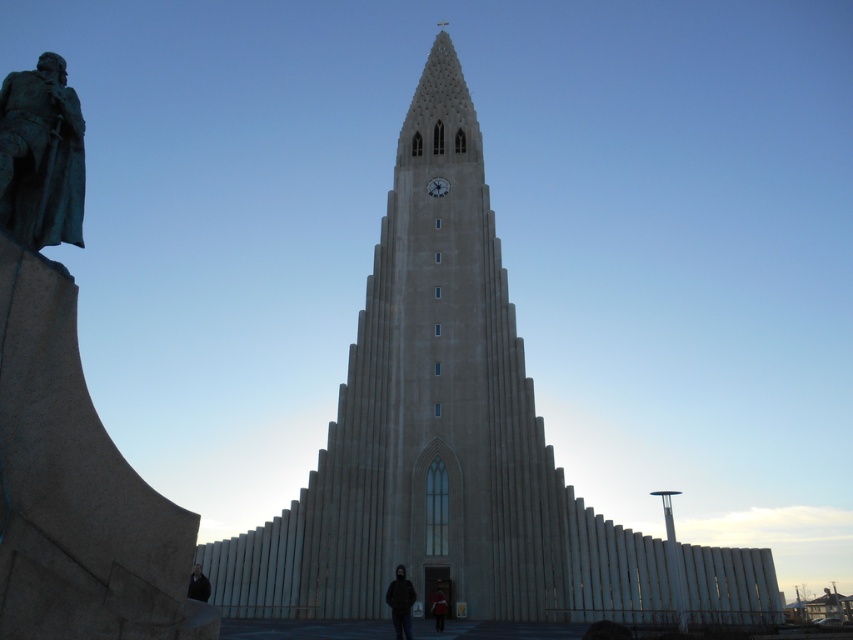
Is beige stone tower at center smaller than black matte jacket at lower center?

No.

Does point (502, 490) lie in front of point (393, 605)?

No, it is behind (393, 605).

You are a GUI agent. You are given a task and a screenshot of the screen. Output one action in this format:
    pyautogui.click(x=<x>, y=<y>)
    Task: Click on the beige stone tower at center
    This screenshot has width=853, height=640.
    Given the screenshot: What is the action you would take?
    pyautogui.click(x=457, y=442)

This screenshot has height=640, width=853. In order to click on beige stone tower at center in this screenshot , I will do `click(457, 442)`.

Which is above, beige stone tower at center or green patina stone statue at left?

beige stone tower at center

Can you confirm if beige stone tower at center is positioned below green patina stone statue at left?

No.

Between point (489, 481) and point (62, 90), which one is positioned behind?

The point (489, 481) is behind.

This screenshot has width=853, height=640. I want to click on beige stone tower at center, so click(457, 442).

Who is positioned more to the right, bronze statue at left or dark brown leather jacket at lower center?

dark brown leather jacket at lower center

Is bronze statue at left wider than dark brown leather jacket at lower center?

No.

Where is `bronze statue at left`? The width and height of the screenshot is (853, 640). bronze statue at left is located at coordinates (41, 156).